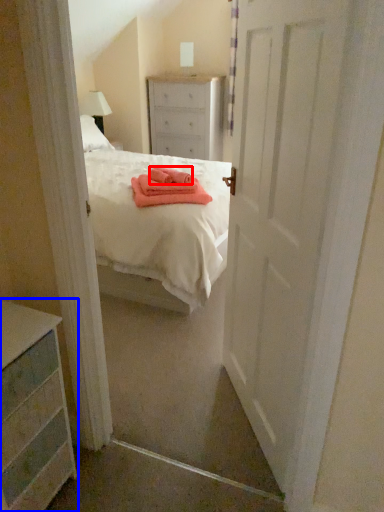
Question: Which object is further to the camera taking this photo, cloth (highlighted by a red box) or chest of drawers (highlighted by a blue box)?

Choices:
 (A) cloth
 (B) chest of drawers

Answer: (A)